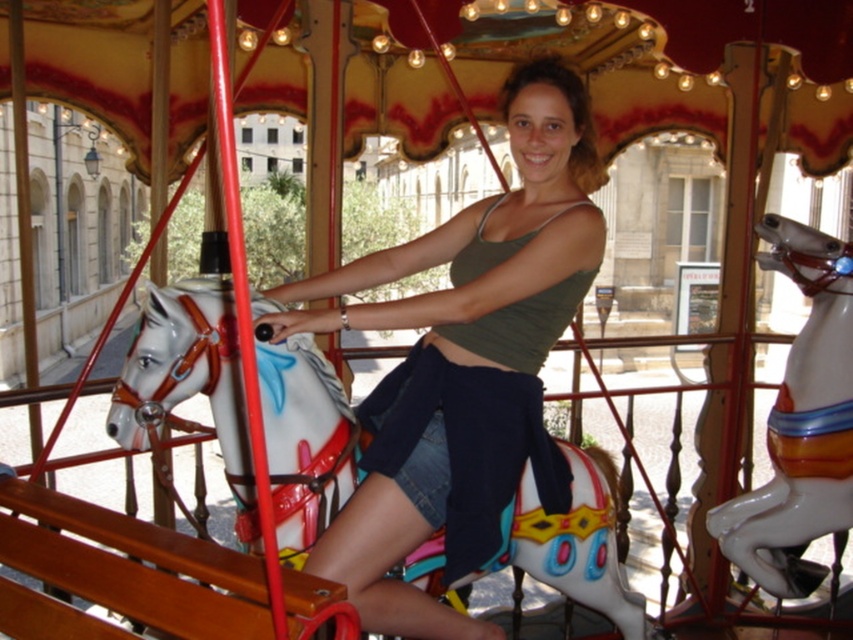
Is green cotton tank top at center taller than white glossy horse at center?

Indeed, green cotton tank top at center has a greater height compared to white glossy horse at center.

This screenshot has width=853, height=640. What are the coordinates of `green cotton tank top at center` in the screenshot? It's located at (461, 356).

Does point (491, 340) come closer to viewer compared to point (578, 538)?

No, (491, 340) is behind (578, 538).

I want to click on green cotton tank top at center, so click(461, 356).

Which is more to the right, green cotton tank top at center or shiny white horse at center?

shiny white horse at center

This screenshot has width=853, height=640. I want to click on green cotton tank top at center, so click(461, 356).

Which is in front, point (309, 424) or point (766, 589)?

Positioned in front is point (309, 424).

Between white glossy horse at center and shiny white horse at center, which one has less height?

white glossy horse at center

Does point (625, 605) come closer to viewer compared to point (802, 344)?

That is True.

What are the coordinates of `white glossy horse at center` in the screenshot? It's located at (189, 381).